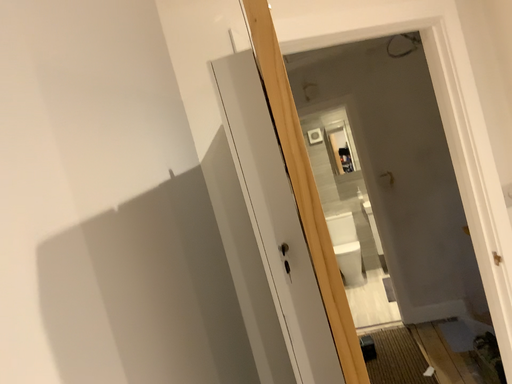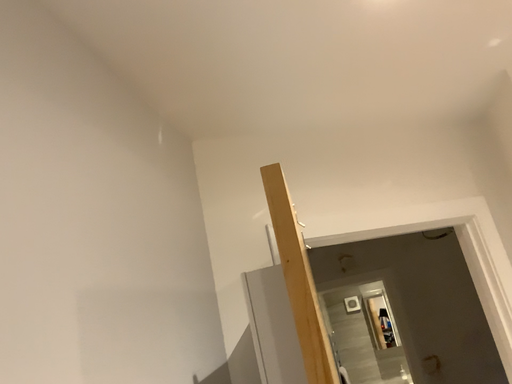
Question: Which way did the camera rotate in the video?

Choices:
 (A) rotated downward
 (B) rotated upward

Answer: (B)